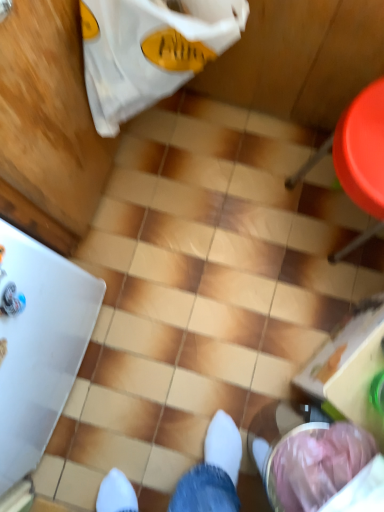
What do you see at coordinates (150, 50) in the screenshot? I see `white fabric grocery bag at upper left` at bounding box center [150, 50].

Locate an element on the screen. The height and width of the screenshot is (512, 384). white fabric grocery bag at upper left is located at coordinates (150, 50).

The width and height of the screenshot is (384, 512). Describe the element at coordinates (357, 159) in the screenshot. I see `red plastic chair at right` at that location.

In order to face red plastic chair at right, should I rotate leftwards or rightwards?

You should rotate right by 22.018 degrees.

Find the location of a particular element. This screenshot has width=384, height=512. red plastic chair at right is located at coordinates (357, 159).

At what (x,y) coordinates should I click in order to perform the action: click on white fabric grocery bag at upper left. Please return your answer as a coordinate pair (x, y). The image size is (384, 512). Looking at the image, I should click on (150, 50).

Would you say white fabric grocery bag at upper left is to the left or to the right of red plastic chair at right in the picture?

In the image, white fabric grocery bag at upper left appears on the left side of red plastic chair at right.

Considering the positions of objects white fabric grocery bag at upper left and red plastic chair at right in the image provided, who is behind, white fabric grocery bag at upper left or red plastic chair at right?

red plastic chair at right is behind.

Is point (235, 4) less distant than point (366, 240)?

Yes, it is.

From the image's perspective, relative to red plastic chair at right, is white fabric grocery bag at upper left above or below?

From the image's perspective, white fabric grocery bag at upper left appears above red plastic chair at right.

From a real-world perspective, is white fabric grocery bag at upper left positioned above or below red plastic chair at right?

In terms of real-world spatial position, white fabric grocery bag at upper left is above red plastic chair at right.

Is white fabric grocery bag at upper left wider or thinner than red plastic chair at right?

Considering their sizes, white fabric grocery bag at upper left looks slimmer than red plastic chair at right.

In terms of height, does white fabric grocery bag at upper left look taller or shorter compared to red plastic chair at right?

Clearly, white fabric grocery bag at upper left is taller compared to red plastic chair at right.

Can you confirm if white fabric grocery bag at upper left is bigger than red plastic chair at right?

Actually, white fabric grocery bag at upper left might be smaller than red plastic chair at right.

Can we say white fabric grocery bag at upper left lies outside red plastic chair at right?

Yes, white fabric grocery bag at upper left is located beyond the bounds of red plastic chair at right.

Are white fabric grocery bag at upper left and red plastic chair at right beside each other?

No, white fabric grocery bag at upper left is not beside red plastic chair at right.

Is white fabric grocery bag at upper left looking in the opposite direction of red plastic chair at right?

white fabric grocery bag at upper left does not have its back to red plastic chair at right.

Looking at this image, how different are the orientations of white fabric grocery bag at upper left and red plastic chair at right in degrees?

They differ by 91.1 degrees in their facing directions.

How far apart are white fabric grocery bag at upper left and red plastic chair at right?

39.45 centimeters.

Find the location of `chair below the white fabric grocery bag at upper left (from the image's perspective)`. chair below the white fabric grocery bag at upper left (from the image's perspective) is located at coordinates (357, 159).

Considering the positions of objects red plastic chair at right and white fabric grocery bag at upper left in the image provided, who is more to the left, red plastic chair at right or white fabric grocery bag at upper left?

white fabric grocery bag at upper left is more to the left.

Is the depth of red plastic chair at right greater than that of white fabric grocery bag at upper left?

Yes, red plastic chair at right is further from the camera.

Is point (352, 182) positioned before point (176, 62)?

Yes, it is in front of point (176, 62).

From the image's perspective, is red plastic chair at right above white fabric grocery bag at upper left?

No.

From a real-world perspective, is red plastic chair at right on white fabric grocery bag at upper left?

No, from a real-world perspective, red plastic chair at right is not above white fabric grocery bag at upper left.

From the picture: Can you confirm if red plastic chair at right is thinner than white fabric grocery bag at upper left?

No, red plastic chair at right is not thinner than white fabric grocery bag at upper left.

Between red plastic chair at right and white fabric grocery bag at upper left, which one has more height?

With more height is white fabric grocery bag at upper left.

Considering the relative sizes of red plastic chair at right and white fabric grocery bag at upper left in the image provided, is red plastic chair at right bigger than white fabric grocery bag at upper left?

Correct, red plastic chair at right is larger in size than white fabric grocery bag at upper left.

Would you say red plastic chair at right is inside or outside white fabric grocery bag at upper left?

red plastic chair at right is outside white fabric grocery bag at upper left.

Is red plastic chair at right touching white fabric grocery bag at upper left?

No, red plastic chair at right is not in contact with white fabric grocery bag at upper left.

Does red plastic chair at right turn towards white fabric grocery bag at upper left?

No, red plastic chair at right is not facing towards white fabric grocery bag at upper left.

Where is `grocery bag above the red plastic chair at right (from a real-world perspective)`? This screenshot has width=384, height=512. grocery bag above the red plastic chair at right (from a real-world perspective) is located at coordinates (150, 50).

In order to click on grocery bag above the red plastic chair at right (from a real-world perspective) in this screenshot , I will do `click(150, 50)`.

Where is `chair lying behind the white fabric grocery bag at upper left`? The height and width of the screenshot is (512, 384). chair lying behind the white fabric grocery bag at upper left is located at coordinates (357, 159).